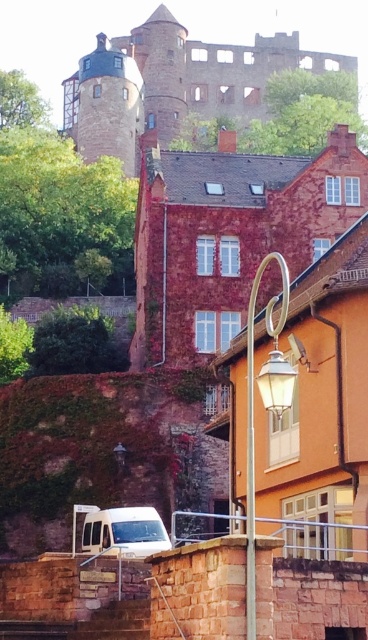
Question: Among these objects, which one is farthest from the camera?

Choices:
 (A) white matte van at lower left
 (B) brown stone castle at upper center
 (C) metallic silver streetlight at center

Answer: (B)

Question: Among these points, which one is nearest to the camera?

Choices:
 (A) (93, 541)
 (B) (263, 365)
 (C) (252, 68)

Answer: (B)

Question: Which point is closer to the camera taking this photo?

Choices:
 (A) (253, 624)
 (B) (218, 81)

Answer: (A)

Question: Does brown stone castle at upper center lie behind white matte van at lower left?

Choices:
 (A) no
 (B) yes

Answer: (B)

Question: Does brown stone castle at upper center appear on the right side of white matte van at lower left?

Choices:
 (A) no
 (B) yes

Answer: (A)

Question: Does brown stone castle at upper center have a lesser width compared to white matte van at lower left?

Choices:
 (A) yes
 (B) no

Answer: (B)